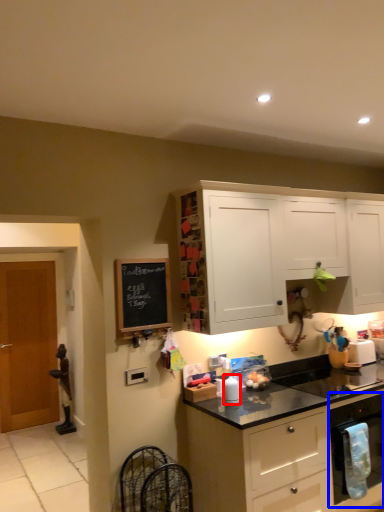
Question: Which object appears farthest to the camera in this image, appliance (highlighted by a red box) or kitchen appliance (highlighted by a blue box)?

Choices:
 (A) appliance
 (B) kitchen appliance

Answer: (B)